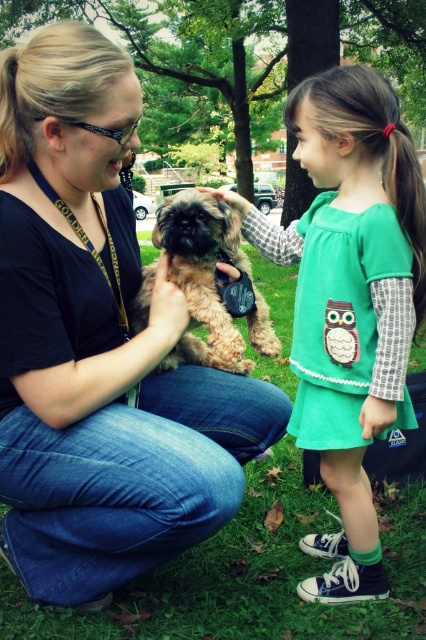
Is matte black shirt at center bigger than green grass at center?

No.

Based on the photo, which is more to the left, matte black shirt at center or green grass at center?

matte black shirt at center is more to the left.

At what (x,y) coordinates should I click in order to perform the action: click on matte black shirt at center. Please return your answer as a coordinate pair (x, y). Looking at the image, I should click on (98, 344).

Is green fabric dress at center above green grass at center?

Actually, green fabric dress at center is below green grass at center.

In order to click on green fabric dress at center in this screenshot , I will do `click(350, 300)`.

Does green grass at center have a larger size compared to fuzzy brown dog at center?

Correct, green grass at center is larger in size than fuzzy brown dog at center.

You are a GUI agent. You are given a task and a screenshot of the screen. Output one action in this format:
    pyautogui.click(x=<x>, y=<y>)
    Task: Click on the green grass at center
    This screenshot has height=640, width=426.
    Given the screenshot: What is the action you would take?
    pyautogui.click(x=256, y=572)

The width and height of the screenshot is (426, 640). In order to click on green grass at center in this screenshot , I will do `click(256, 572)`.

I want to click on green grass at center, so click(x=256, y=572).